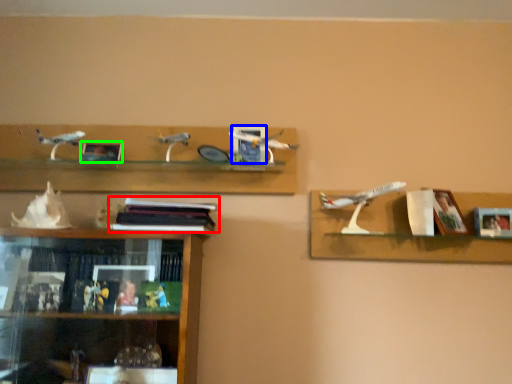
Question: Considering the real-world distances, which object is closest to book (highlighted by a red box)? picture frame (highlighted by a blue box) or picture frame (highlighted by a green box).

Choices:
 (A) picture frame
 (B) picture frame

Answer: (A)